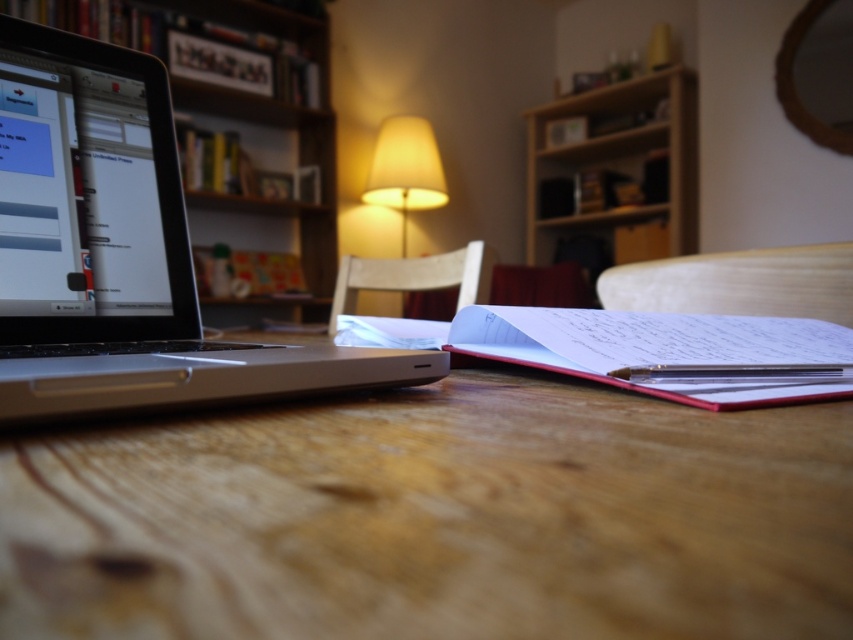
Is the position of white paper notebook at center more distant than that of wooden bookshelf at upper center?

No, white paper notebook at center is closer to the viewer.

Looking at this image, does white paper notebook at center have a lesser height compared to wooden bookshelf at upper center?

Indeed, white paper notebook at center has a lesser height compared to wooden bookshelf at upper center.

Who is more distant from viewer, (335, 317) or (592, 106)?

The point (592, 106) is more distant.

Where is `white paper notebook at center`? Image resolution: width=853 pixels, height=640 pixels. white paper notebook at center is located at coordinates (633, 348).

Who is positioned more to the right, wooden table at center or matte yellow lampshade at center?

wooden table at center

Between wooden table at center and matte yellow lampshade at center, which one is positioned lower?

wooden table at center is lower down.

Between point (769, 413) and point (363, 196), which one is positioned in front?

Point (769, 413) is in front.

Find the location of a particular element. wooden table at center is located at coordinates (433, 516).

Looking at this image, does silver metallic laptop at left have a smaller size compared to white paper notebook at center?

No.

Locate an element on the screen. This screenshot has width=853, height=640. silver metallic laptop at left is located at coordinates (119, 250).

Which is behind, point (44, 214) or point (686, 342)?

The point (44, 214) is behind.

You are a GUI agent. You are given a task and a screenshot of the screen. Output one action in this format:
    pyautogui.click(x=<x>, y=<y>)
    Task: Click on the silver metallic laptop at left
    
    Given the screenshot: What is the action you would take?
    pyautogui.click(x=119, y=250)